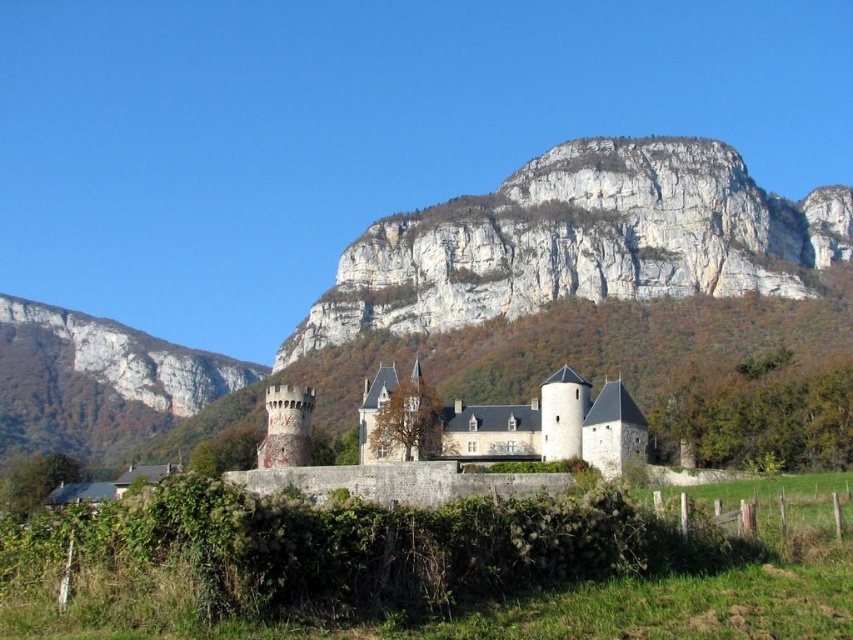
Between smooth gray rock at left and stone castle at center, which one is positioned higher?

stone castle at center is higher up.

Is smooth gray rock at left thinner than stone castle at center?

No.

At what (x,y) coordinates should I click in order to perform the action: click on smooth gray rock at left. Please return your answer as a coordinate pair (x, y). Looking at the image, I should click on (97, 381).

Which is behind, point (523, 230) or point (136, 355)?

The point (136, 355) is behind.

Is white rock cliff at upper center thinner than smooth gray rock at left?

No, white rock cliff at upper center is not thinner than smooth gray rock at left.

Does point (598, 266) come in front of point (4, 332)?

Yes, point (598, 266) is in front of point (4, 332).

Locate an element on the screen. The image size is (853, 640). white rock cliff at upper center is located at coordinates (581, 241).

Which is behind, point (585, 138) or point (451, 445)?

Positioned behind is point (585, 138).

Is point (692, 292) closer to camera compared to point (379, 456)?

That is False.

This screenshot has height=640, width=853. Find the location of `white rock cliff at upper center`. white rock cliff at upper center is located at coordinates (581, 241).